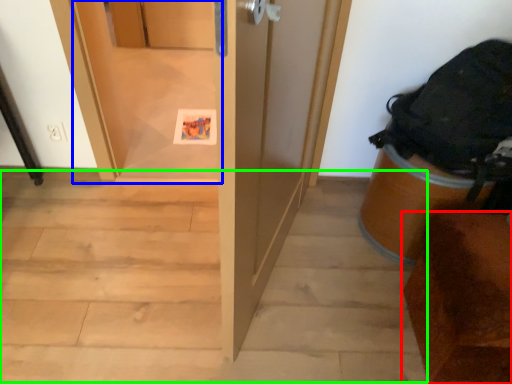
Question: Which object is the closest to the furniture (highlighted by a red box)? Choose among these: screen door (highlighted by a blue box) or stairwell (highlighted by a green box).

Choices:
 (A) screen door
 (B) stairwell

Answer: (B)